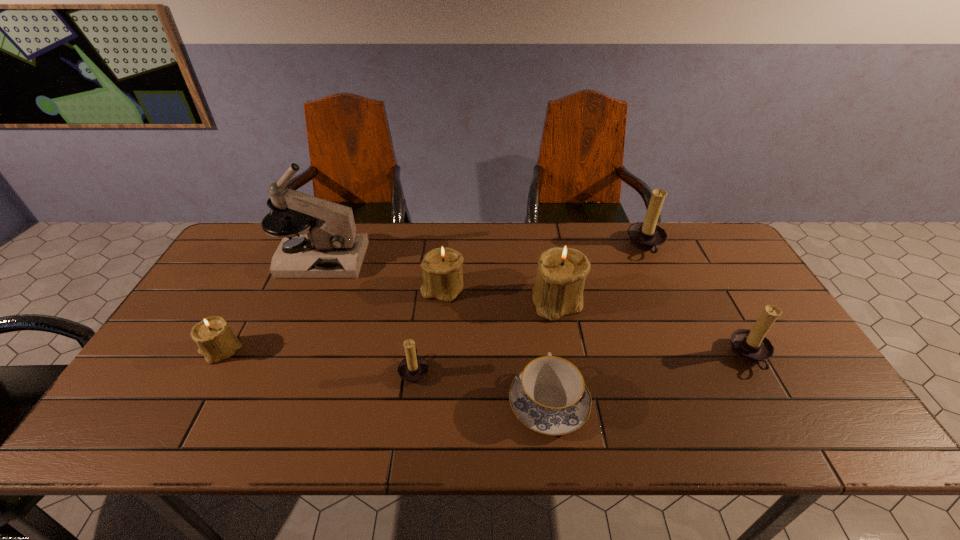
Locate an element on the screen. This screenshot has height=540, width=960. the fourth closest candle holder relative to the second beige candle_holder from right to left is located at coordinates (647, 236).

Identify the location of brown candle holder object that ranks as the second closest to the leftmost candle holder. (647, 236).

Where is `brown candle holder that stands as the closest to the second beige candle_holder from right to left`? brown candle holder that stands as the closest to the second beige candle_holder from right to left is located at coordinates (413, 369).

Find the location of a particular element. This screenshot has height=540, width=960. beige candle_holder that can be found as the closest to the chinaware is located at coordinates (558, 290).

Choose which beige candle_holder is the nearest neighbor to the fourth candle holder from left to right. Please provide its 2D coordinates. Your answer should be formatted as a tuple, i.e. [(x, y)], where the tuple contains the x and y coordinates of a point satisfying the conditions above.

[(442, 274)]

I want to click on blank space that satisfies the following two spatial constraints: 1. with the handle on the side of the chinaware; 2. on the wick of the leftmost brown candle holder, so (x=544, y=370).

Where is `free location that satisfies the following two spatial constraints: 1. on the wick of the biggest brown candle holder; 2. on the front side of the biggest beige candle_holder`? The width and height of the screenshot is (960, 540). free location that satisfies the following two spatial constraints: 1. on the wick of the biggest brown candle holder; 2. on the front side of the biggest beige candle_holder is located at coordinates (671, 301).

The image size is (960, 540). Identify the location of vacant region that satisfies the following two spatial constraints: 1. on the wick of the smallest brown candle holder; 2. with the handle on the side of the blue chinaware. (410, 403).